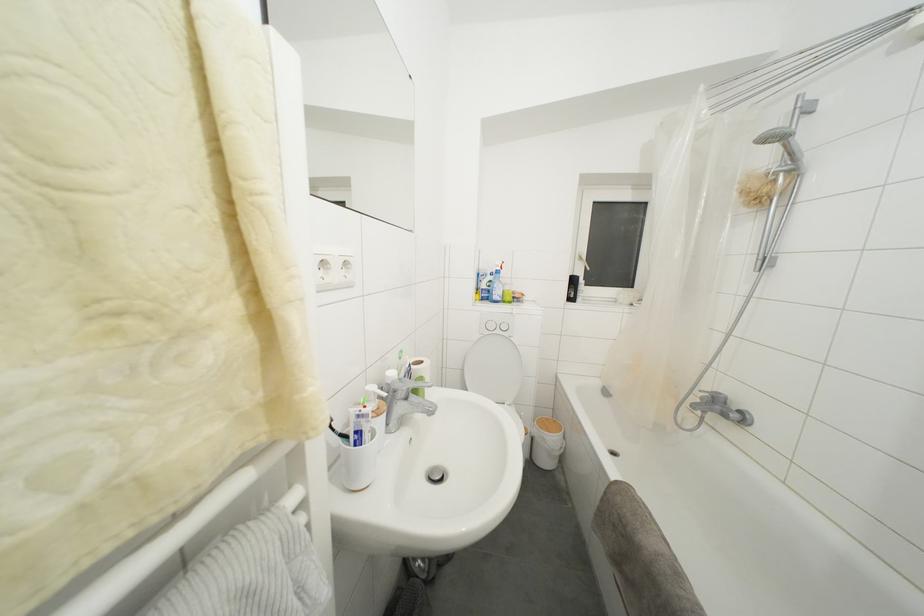
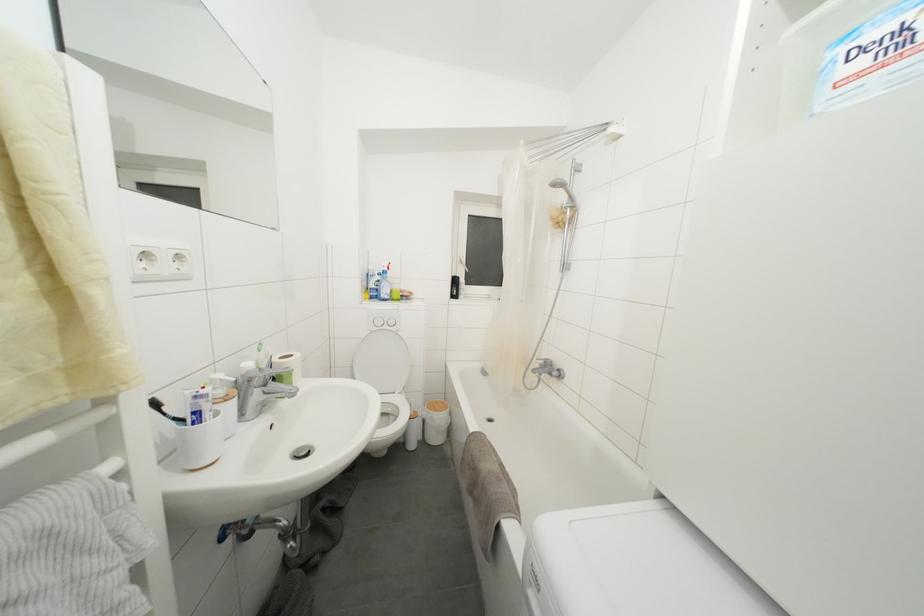
In a continuous first-person perspective shot, in which direction is the camera moving?

The cameraman moved toward right, backward.